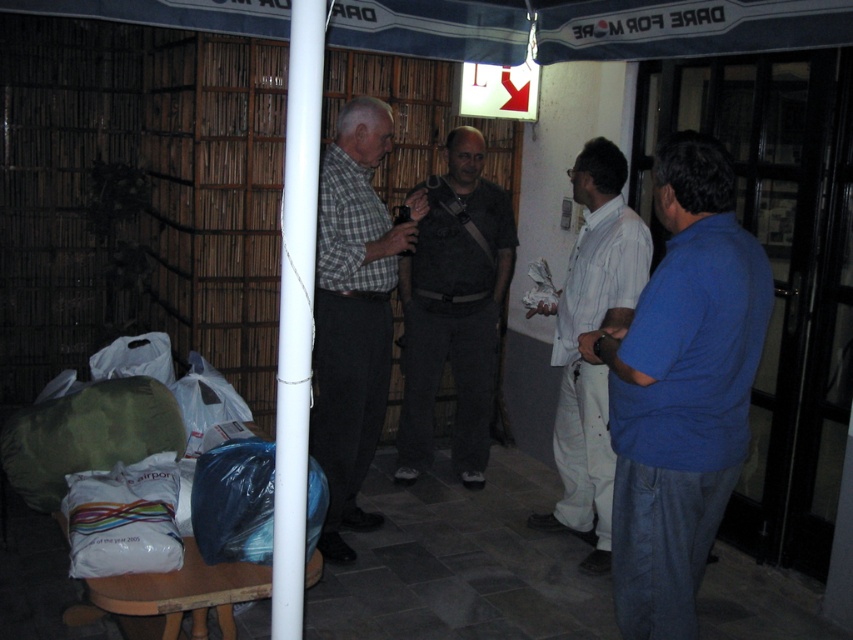
Is point (463, 138) in front of point (282, 420)?

No, it is behind (282, 420).

Between point (403, 298) and point (289, 337), which one is positioned behind?

The point (403, 298) is more distant.

Is point (428, 346) positioned before point (294, 65)?

That is False.

This screenshot has width=853, height=640. I want to click on dark gray fabric shirt at center, so click(x=454, y=308).

Is blue cotton shirt at right thinner than white plastic pole at center?

No, blue cotton shirt at right is not thinner than white plastic pole at center.

The height and width of the screenshot is (640, 853). What do you see at coordinates (682, 388) in the screenshot?
I see `blue cotton shirt at right` at bounding box center [682, 388].

Locate an element on the screen. The width and height of the screenshot is (853, 640). blue cotton shirt at right is located at coordinates (682, 388).

Does point (363, 337) come in front of point (320, 90)?

No, (363, 337) is further to viewer.

Does checkered fabric shirt at center lie behind white plastic pole at center?

That is True.

Measure the distance between checkered fabric shirt at center and camera.

They are 3.15 meters apart.

This screenshot has width=853, height=640. I want to click on checkered fabric shirt at center, so click(352, 314).